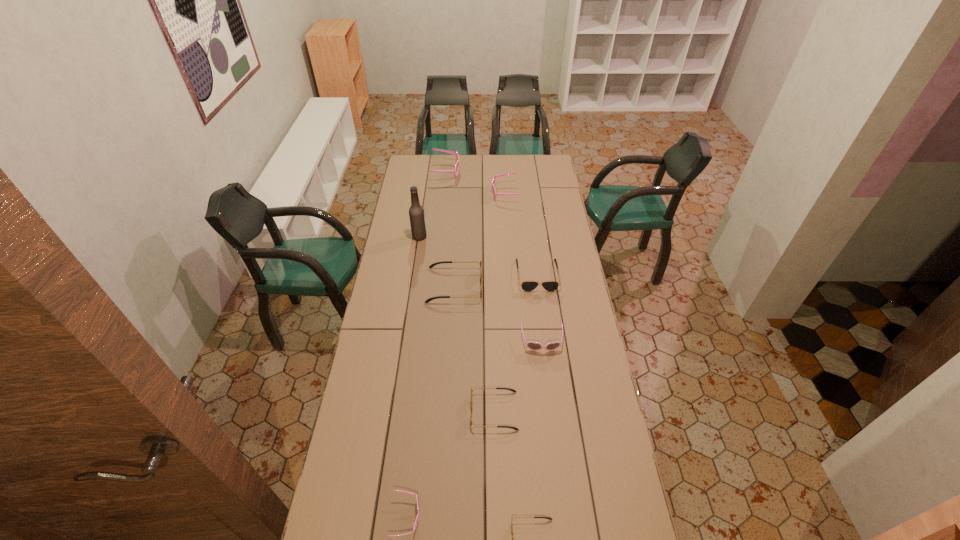
Where is `the seventh nearest object`? This screenshot has width=960, height=540. the seventh nearest object is located at coordinates (416, 212).

Identify the location of beer bottle. (416, 212).

Where is `the second tallest object`? Image resolution: width=960 pixels, height=540 pixels. the second tallest object is located at coordinates (455, 171).

The height and width of the screenshot is (540, 960). In order to click on the farthest object in this screenshot , I will do `click(455, 171)`.

This screenshot has width=960, height=540. I want to click on the seventh nearest sunglasses, so click(x=494, y=178).

I want to click on the second farthest object, so click(494, 178).

You are a GUI agent. You are given a task and a screenshot of the screen. Output one action in this format:
    pyautogui.click(x=<x>, y=<y>)
    Task: Click on the biggest black sunglasses
    Image resolution: width=960 pixels, height=540 pixels.
    Given the screenshot: What is the action you would take?
    pyautogui.click(x=480, y=262)

The height and width of the screenshot is (540, 960). What are the coordinates of `the second biggest black sunglasses` in the screenshot? It's located at (527, 285).

The height and width of the screenshot is (540, 960). What are the coordinates of `the sixth farthest object` in the screenshot? It's located at (534, 346).

This screenshot has width=960, height=540. In order to click on the fourth nearest sunglasses in this screenshot , I will do `click(534, 346)`.